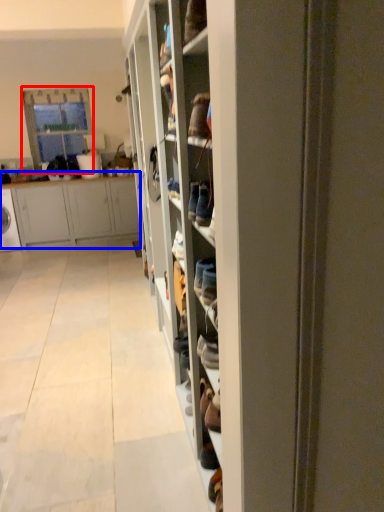
Question: Among these objects, which one is farthest to the camera, glass door (highlighted by a red box) or cabinetry (highlighted by a blue box)?

Choices:
 (A) glass door
 (B) cabinetry

Answer: (A)